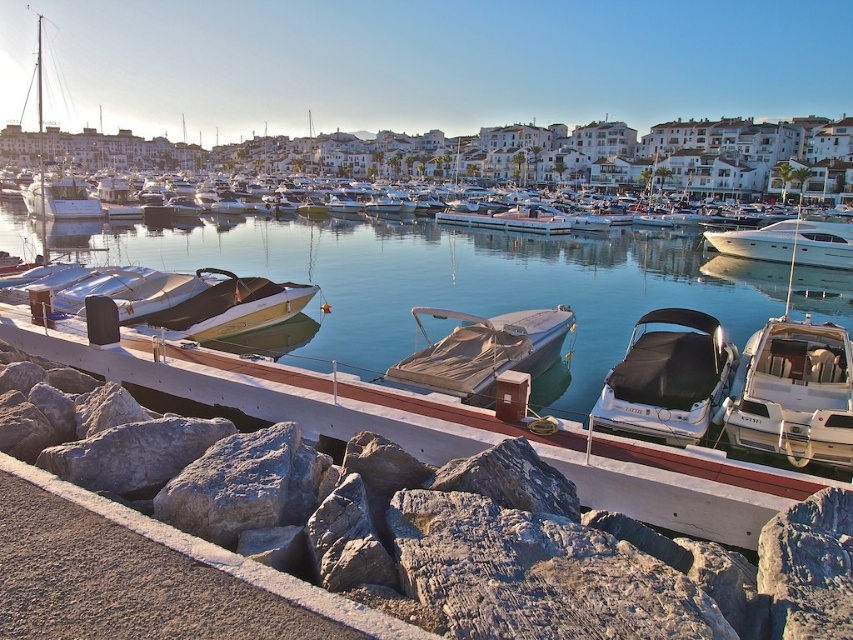
You are a visitor at the marina and want to take a photo of both the black tarpaulin boat at center and the white glossy yacht at right. Based on their positions, which boat should you frame first in your camera viewfinder to ensure both are captured in the same shot?

You should frame the black tarpaulin boat at center first since it is positioned to the left of the white glossy yacht at right, allowing both to be included in the same shot by adjusting the viewfinder to the left side.

You are standing at the edge of the walkway and want to take a photo of the beige canvas boat at center. If your camera has a maximum zoom range of 10 meters, will you be able to capture the boat clearly without moving closer?

The beige canvas boat at center is 15.86 meters away from the camera. Since the camera can only zoom up to 10 meters, it won not be able to capture the boat clearly without moving closer.